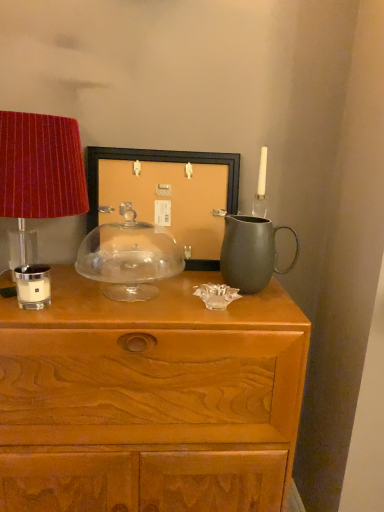
Question: From a real-world perspective, relative to white matte candle holder at left, which is the 2th candle holder from right to left, is velvet red lampshade at left vertically above or below?

Choices:
 (A) above
 (B) below

Answer: (A)

Question: From the image's perspective, is velvet red lampshade at left above or below white matte candle holder at left, marked as the 2th candle holder in a back-to-front arrangement?

Choices:
 (A) above
 (B) below

Answer: (A)

Question: Which object is positioned closest to the matte gray jug at right?

Choices:
 (A) matte black picture frame at center
 (B) transparent glass cake stand at center, which is the 1th candle holder from back to front
 (C) velvet red lampshade at left
 (D) wooden chest of drawers at center
 (E) white matte candle holder at left, which is the 1th candle holder from left to right

Answer: (A)

Question: Estimate the real-world distances between objects in this image. Which object is closer to the wooden chest of drawers at center?

Choices:
 (A) matte black picture frame at center
 (B) transparent glass cake stand at center, which is the 1th candle holder from back to front
 (C) matte gray jug at right
 (D) white matte candle holder at left, which is the 1th candle holder from left to right
 (E) velvet red lampshade at left

Answer: (B)